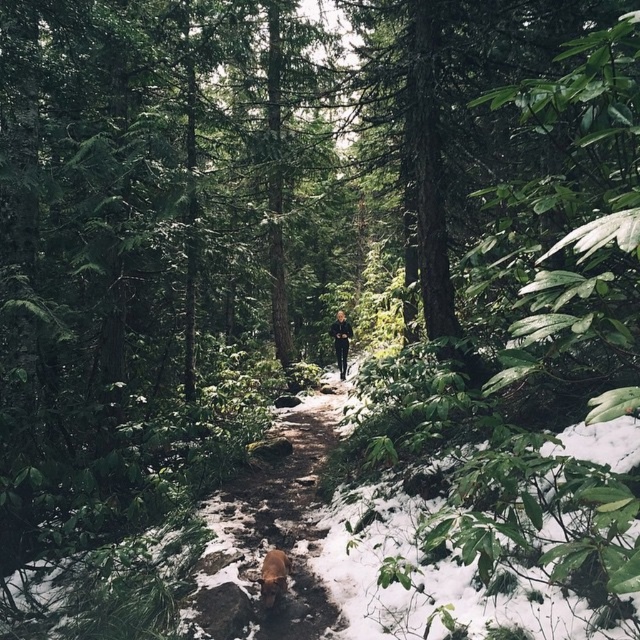
In the scene shown: You are standing at the camera position observing the forest scene. The brown fur dog at center is your companion. To ensure safety, you need to know its exact location. According to the coordinates provided, where is the brown fur dog positioned relative to the trail?

The brown fur dog at center is located at point coordinates 0.903 on the x axis and 0.428 on the y axis, which places it precisely at the center of the trail.

You are a hiker trying to decide whether to bring your dog along for a walk on the narrow trail in the forest. The trail is only wide enough for one person at a time. Given the sizes of the brown fur dog at center and the black matte pants at center, can both the dog and a person walk side by side on the trail?

The brown fur dog at center is smaller than the black matte pants at center. Since the trail is only wide enough for one person at a time, the dog and the person cannot walk side by side because the person requires the full width of the trail.

You are standing at the edge of the forest and see the snowy dirt path at center and the brown fur dog at center. Which object is nearer to you?

The snowy dirt path at center is closer to the viewer than the brown fur dog at center.